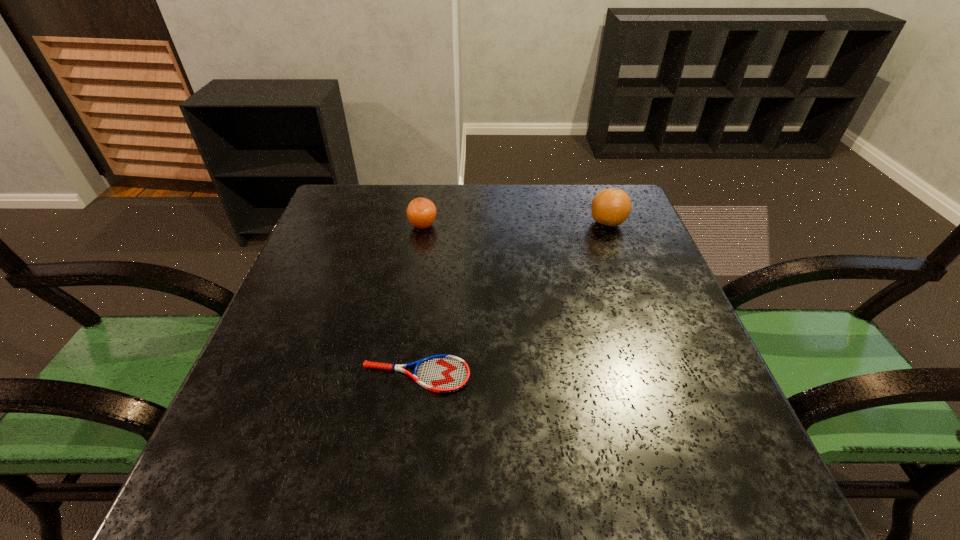
The image size is (960, 540). Find the location of `the right orange`. the right orange is located at coordinates (611, 207).

At what (x,y) coordinates should I click in order to perform the action: click on the tallest object. Please return your answer as a coordinate pair (x, y). Looking at the image, I should click on (611, 207).

Locate an element on the screen. The image size is (960, 540). the second tallest object is located at coordinates (421, 212).

Find the location of a particular element. The height and width of the screenshot is (540, 960). the shorter orange is located at coordinates (421, 212).

Locate an element on the screen. the shortest object is located at coordinates (442, 373).

You are a GUI agent. You are given a task and a screenshot of the screen. Output one action in this format:
    pyautogui.click(x=<x>, y=<y>)
    Task: Click on the nearest object
    The image size is (960, 540).
    Given the screenshot: What is the action you would take?
    pyautogui.click(x=442, y=373)

You are a GUI agent. You are given a task and a screenshot of the screen. Output one action in this format:
    pyautogui.click(x=<x>, y=<y>)
    Task: Click on the free space located 0.090m on the front of the taller orange
    The image size is (960, 540).
    Given the screenshot: What is the action you would take?
    pyautogui.click(x=620, y=256)

Find the location of a particular element. The height and width of the screenshot is (540, 960). vacant space located on the back of the left orange is located at coordinates (428, 195).

This screenshot has height=540, width=960. What are the coordinates of `vacant point located 0.050m on the back of the tennis racket` in the screenshot? It's located at (420, 338).

The image size is (960, 540). I want to click on object that is at the right edge, so click(611, 207).